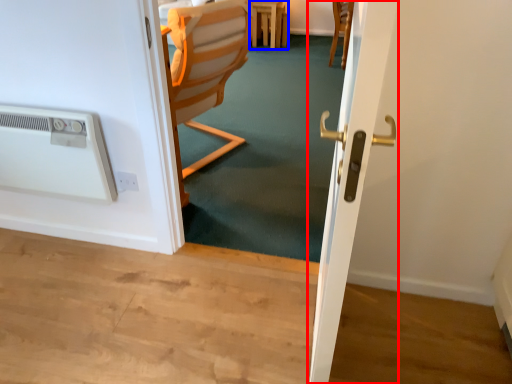
Question: Which object is further to the camera taking this photo, screen door (highlighted by a red box) or furniture (highlighted by a blue box)?

Choices:
 (A) screen door
 (B) furniture

Answer: (B)